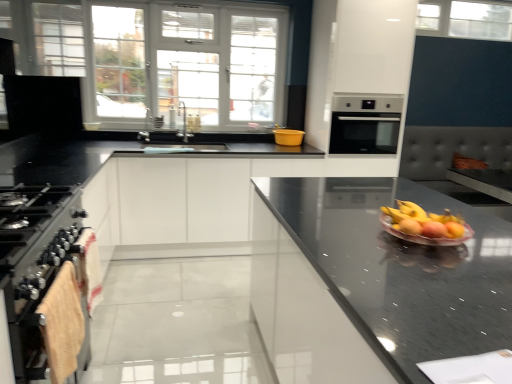
Describe the element at coordinates (465, 19) in the screenshot. The width and height of the screenshot is (512, 384). I see `clear glass window at upper center, marked as the 2th window in a bottom-to-top arrangement` at that location.

What do you see at coordinates (62, 323) in the screenshot? Image resolution: width=512 pixels, height=384 pixels. I see `beige towel at lower left` at bounding box center [62, 323].

Measure the distance between beige towel at lower left and camera.

beige towel at lower left is 1.27 meters away from camera.

The image size is (512, 384). What do you see at coordinates (34, 263) in the screenshot?
I see `stainless steel oven at left` at bounding box center [34, 263].

Consider the image. What is the approximate height of black glossy countertop at center?

The height of black glossy countertop at center is 35.76 inches.

What is the approximate width of satin silver oven at center?

25.98 inches.

The image size is (512, 384). Describe the element at coordinates (365, 125) in the screenshot. I see `satin silver oven at center` at that location.

This screenshot has height=384, width=512. Identify the location of clear glass window at upper center, marked as the 2th window in a bottom-to-top arrangement. (465, 19).

Considering the sizes of objects satin silver oven at center and clear glass window at upper center, marked as the 2th window in a bottom-to-top arrangement, in the image provided, who is smaller, satin silver oven at center or clear glass window at upper center, marked as the 2th window in a bottom-to-top arrangement,?

clear glass window at upper center, marked as the 2th window in a bottom-to-top arrangement.

Between satin silver oven at center and clear glass window at upper center, the first window positioned from the top, which one appears on the right side from the viewer's perspective?

clear glass window at upper center, the first window positioned from the top, is more to the right.

Can we say satin silver oven at center lies outside clear glass window at upper center, marked as the 2th window in a bottom-to-top arrangement?

Yes, satin silver oven at center is outside of clear glass window at upper center, marked as the 2th window in a bottom-to-top arrangement.

From a real-world perspective, is satin silver oven at center on top of clear glass window at upper center, marked as the 1th window in a right-to-left arrangement?

No, from a real-world perspective, satin silver oven at center is not above clear glass window at upper center, marked as the 1th window in a right-to-left arrangement.

Is shiny glass bowl of mixed fruits at center-right looking in the opposite direction of yellow plastic bowl at center?

That's not correct — shiny glass bowl of mixed fruits at center-right is not looking away from yellow plastic bowl at center.

From a real-world perspective, is shiny glass bowl of mixed fruits at center-right over yellow plastic bowl at center?

No, from a real-world perspective, shiny glass bowl of mixed fruits at center-right is not on top of yellow plastic bowl at center.

From the image's perspective, is shiny glass bowl of mixed fruits at center-right above or below yellow plastic bowl at center?

Clearly, from the image's perspective, shiny glass bowl of mixed fruits at center-right is below yellow plastic bowl at center.

Considering the relative positions of shiny glass bowl of mixed fruits at center-right and yellow plastic bowl at center in the image provided, is shiny glass bowl of mixed fruits at center-right to the left of yellow plastic bowl at center from the viewer's perspective?

Incorrect, shiny glass bowl of mixed fruits at center-right is not on the left side of yellow plastic bowl at center.

From the image's perspective, relative to yellow plastic bowl at center, is white glass window at upper center, the second window in the right-to-left sequence, above or below?

white glass window at upper center, the second window in the right-to-left sequence, is situated higher than yellow plastic bowl at center in the image.

Considering the sizes of objects white glass window at upper center, the first window positioned from the bottom, and yellow plastic bowl at center in the image provided, who is taller, white glass window at upper center, the first window positioned from the bottom, or yellow plastic bowl at center?

Standing taller between the two is white glass window at upper center, the first window positioned from the bottom.

How different are the orientations of white glass window at upper center, the second window in the right-to-left sequence, and yellow plastic bowl at center in degrees?

white glass window at upper center, the second window in the right-to-left sequence, and yellow plastic bowl at center are facing 1.49 degrees away from each other.

Is there a large distance between white glass window at upper center, the second window in the right-to-left sequence, and yellow plastic bowl at center?

That's right, there is a large distance between white glass window at upper center, the second window in the right-to-left sequence, and yellow plastic bowl at center.

From the picture: Considering the sizes of objects stainless steel oven at left and beige towel at lower left in the image provided, who is thinner, stainless steel oven at left or beige towel at lower left?

beige towel at lower left.

Does stainless steel oven at left appear on the left side of beige towel at lower left?

Indeed, stainless steel oven at left is positioned on the left side of beige towel at lower left.

Is stainless steel oven at left oriented towards beige towel at lower left?

Yes, stainless steel oven at left faces towards beige towel at lower left.

Can you confirm if stainless steel oven at left is smaller than beige towel at lower left?

Actually, stainless steel oven at left might be larger than beige towel at lower left.

Measure the distance between satin silver oven at center and yellow plastic bowl at center.

satin silver oven at center and yellow plastic bowl at center are 52.23 centimeters apart from each other.

Who is smaller, satin silver oven at center or yellow plastic bowl at center?

With smaller size is yellow plastic bowl at center.

What's the angular difference between satin silver oven at center and yellow plastic bowl at center's facing directions?

The angle between the facing direction of satin silver oven at center and the facing direction of yellow plastic bowl at center is 0.000362 degrees.

Would you say satin silver oven at center is a long distance from yellow plastic bowl at center?

satin silver oven at center is actually quite close to yellow plastic bowl at center.

Looking at this image, from the image's perspective, which one is positioned higher, satin silver oven at center or beige towel at lower left?

From the image's view, satin silver oven at center is above.

Can you confirm if satin silver oven at center is positioned to the left of beige towel at lower left?

No, satin silver oven at center is not to the left of beige towel at lower left.

Which is farther from the camera, (x=396, y=104) or (x=79, y=331)?

Point (x=396, y=104)

In the image, there is a beige towel at lower left. Identify the location of oven above it (from the image's perspective). (365, 125).

Is clear glass window at upper center, marked as the 1th window in a right-to-left arrangement, next to shiny glass bowl of mixed fruits at center-right and touching it?

clear glass window at upper center, marked as the 1th window in a right-to-left arrangement, is not next to shiny glass bowl of mixed fruits at center-right, and they're not touching.

From a real-world perspective, is clear glass window at upper center, placed as the 2th window when sorted from left to right, above or below shiny glass bowl of mixed fruits at center-right?

In terms of real-world spatial position, clear glass window at upper center, placed as the 2th window when sorted from left to right, is above shiny glass bowl of mixed fruits at center-right.

Between clear glass window at upper center, marked as the 2th window in a bottom-to-top arrangement, and shiny glass bowl of mixed fruits at center-right, which one has smaller width?

Thinner between the two is clear glass window at upper center, marked as the 2th window in a bottom-to-top arrangement.

Does clear glass window at upper center, the first window positioned from the top, appear on the left side of shiny glass bowl of mixed fruits at center-right?

Incorrect, clear glass window at upper center, the first window positioned from the top, is not on the left side of shiny glass bowl of mixed fruits at center-right.

Identify the location of the 2nd window above the satin silver oven at center (from the image's perspective). The height and width of the screenshot is (384, 512). (465, 19).

I want to click on glass bowl that appears behind the shiny glass bowl of mixed fruits at center-right, so click(x=288, y=137).

From the image, which object appears to be farther from beige towel at lower left, yellow plastic bowl at center or clear glass window at upper center, the first window positioned from the top?

clear glass window at upper center, the first window positioned from the top, is further to beige towel at lower left.

Estimate the real-world distances between objects in this image. Which object is closer to satin silver oven at center, clear glass window at upper center, placed as the 2th window when sorted from left to right, or white glass window at upper center, which appears as the 1th window when viewed from the left?

white glass window at upper center, which appears as the 1th window when viewed from the left.

From the image, which object appears to be farther from stainless steel oven at left, white glass window at upper center, which appears as the 1th window when viewed from the left, or black glossy countertop at center?

white glass window at upper center, which appears as the 1th window when viewed from the left, is positioned further to the anchor stainless steel oven at left.

Which object lies nearer to the anchor point yellow plastic bowl at center, black glossy countertop at center or satin silver oven at center?

Based on the image, satin silver oven at center appears to be nearer to yellow plastic bowl at center.

Looking at the image, which one is located closer to yellow plastic bowl at center, black glossy countertop at center or beige towel at lower left?

black glossy countertop at center.

From the image, which object appears to be nearer to yellow plastic bowl at center, stainless steel oven at left or white glass window at upper center, which is the 2th window from top to bottom?

Based on the image, white glass window at upper center, which is the 2th window from top to bottom, appears to be nearer to yellow plastic bowl at center.

Estimate the real-world distances between objects in this image. Which object is further from white glass window at upper center, the first window positioned from the bottom, satin silver oven at center or yellow plastic bowl at center?

satin silver oven at center is further to white glass window at upper center, the first window positioned from the bottom.

Estimate the real-world distances between objects in this image. Which object is closer to clear glass window at upper center, marked as the 1th window in a right-to-left arrangement, satin silver oven at center or shiny glass bowl of mixed fruits at center-right?

satin silver oven at center.

Find the location of a particular element. This screenshot has height=384, width=512. window between stainless steel oven at left and yellow plastic bowl at center from front to back is located at coordinates (161, 59).

I want to click on oven positioned between shiny glass bowl of mixed fruits at center-right and white glass window at upper center, which appears as the 1th window when viewed from the left, from near to far, so click(365, 125).

Locate an element on the screen. This screenshot has height=384, width=512. window between black glossy countertop at center and clear glass window at upper center, the first window positioned from the top, along the z-axis is located at coordinates (161, 59).

The width and height of the screenshot is (512, 384). Find the location of `fruit salad between stainless steel oven at left and yellow plastic bowl at center in the front-back direction`. fruit salad between stainless steel oven at left and yellow plastic bowl at center in the front-back direction is located at coordinates (424, 225).